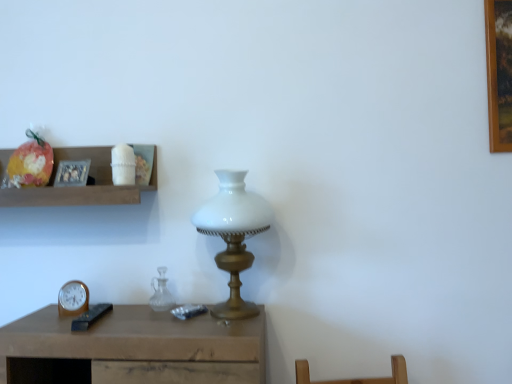
Question: From the image's perspective, is wooden clock at lower left on transparent glass vase at center?

Choices:
 (A) no
 (B) yes

Answer: (A)

Question: Is wooden clock at lower left to the left of transparent glass vase at center from the viewer's perspective?

Choices:
 (A) no
 (B) yes

Answer: (B)

Question: Is wooden clock at lower left not inside transparent glass vase at center?

Choices:
 (A) yes
 (B) no

Answer: (A)

Question: Does wooden clock at lower left appear on the right side of transparent glass vase at center?

Choices:
 (A) yes
 (B) no

Answer: (B)

Question: Can you confirm if wooden clock at lower left is thinner than transparent glass vase at center?

Choices:
 (A) no
 (B) yes

Answer: (B)

Question: Choose the correct answer: Is white glass lamp at center inside transparent glass vase at center or outside it?

Choices:
 (A) outside
 (B) inside

Answer: (A)

Question: From a real-world perspective, is white glass lamp at center positioned above or below transparent glass vase at center?

Choices:
 (A) below
 (B) above

Answer: (B)

Question: Would you say white glass lamp at center is to the left or to the right of transparent glass vase at center in the picture?

Choices:
 (A) left
 (B) right

Answer: (B)

Question: Is point (224, 195) positioned closer to the camera than point (155, 309)?

Choices:
 (A) closer
 (B) farther

Answer: (A)

Question: Considering the positions of shiny plastic bag at upper left and wooden shelf at upper left in the image, is shiny plastic bag at upper left taller or shorter than wooden shelf at upper left?

Choices:
 (A) tall
 (B) short

Answer: (B)

Question: Is shiny plastic bag at upper left situated inside wooden shelf at upper left or outside?

Choices:
 (A) outside
 (B) inside

Answer: (B)

Question: From a real-world perspective, is shiny plastic bag at upper left physically located above or below wooden shelf at upper left?

Choices:
 (A) below
 (B) above

Answer: (B)

Question: Considering their positions, is shiny plastic bag at upper left located in front of or behind wooden shelf at upper left?

Choices:
 (A) behind
 (B) front

Answer: (A)

Question: From the image's perspective, is wooden shelf at upper left located above or below shiny plastic bag at upper left?

Choices:
 (A) above
 (B) below

Answer: (B)

Question: Is wooden shelf at upper left in front of or behind shiny plastic bag at upper left in the image?

Choices:
 (A) front
 (B) behind

Answer: (A)